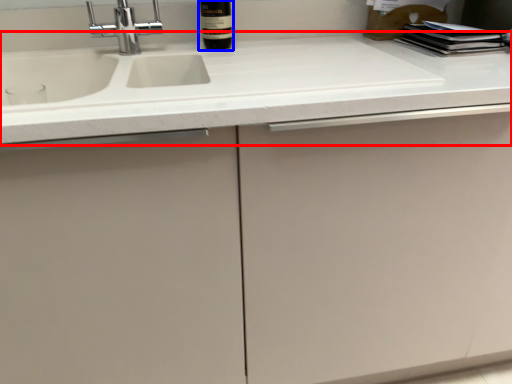
Question: Which object is further to the camera taking this photo, countertop (highlighted by a red box) or bottle (highlighted by a blue box)?

Choices:
 (A) countertop
 (B) bottle

Answer: (B)